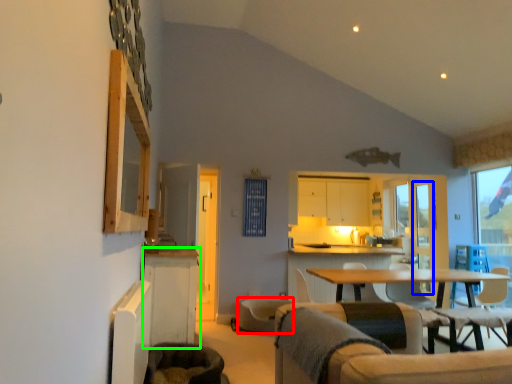
Question: Based on their relative distances, which object is nearer to swivel chair (highlighted by a red box)? Choose from screen door (highlighted by a blue box) and cabinetry (highlighted by a green box).

Choices:
 (A) screen door
 (B) cabinetry

Answer: (B)